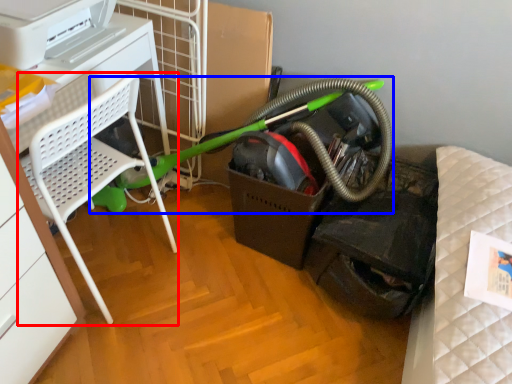
Question: Which of the following is the closest to the observer, furniture (highlighted by a red box) or garden hose (highlighted by a blue box)?

Choices:
 (A) furniture
 (B) garden hose

Answer: (A)